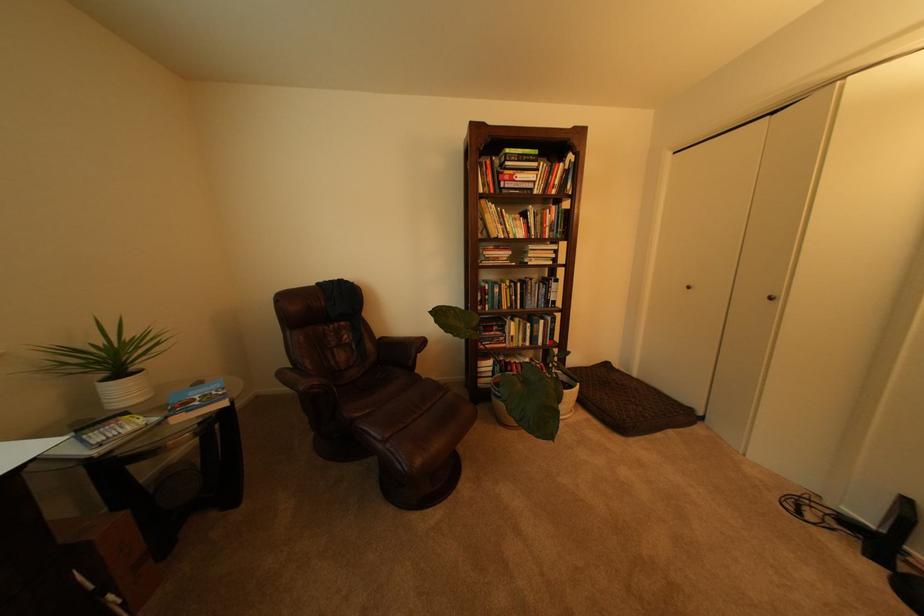
This screenshot has width=924, height=616. Describe the element at coordinates (298, 382) in the screenshot. I see `the brown chair armrest` at that location.